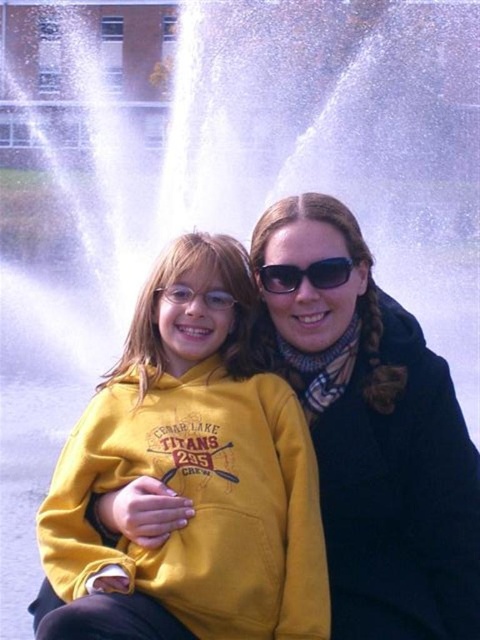
You are a photographer trying to capture the yellow fleece hoodie at center in the image. The camera you are using has a focus point at coordinate point (197, 464). Will this focus point be effective for capturing the yellow fleece hoodie at center?

Yes, the focus point at coordinate point (197, 464) is effective because the point indicates the location of the yellow fleece hoodie at center.

You are standing at the point marked as point (182, 257) and want to take a photo of the water fountain in the background. The camera you are using has a range of 100 feet. Will you be able to capture the fountain in your photo?

The distance between point (182, 257) and the camera is 126.16 feet, which exceeds the camera range of 100 feet. Therefore, you will not be able to capture the fountain in your photo.